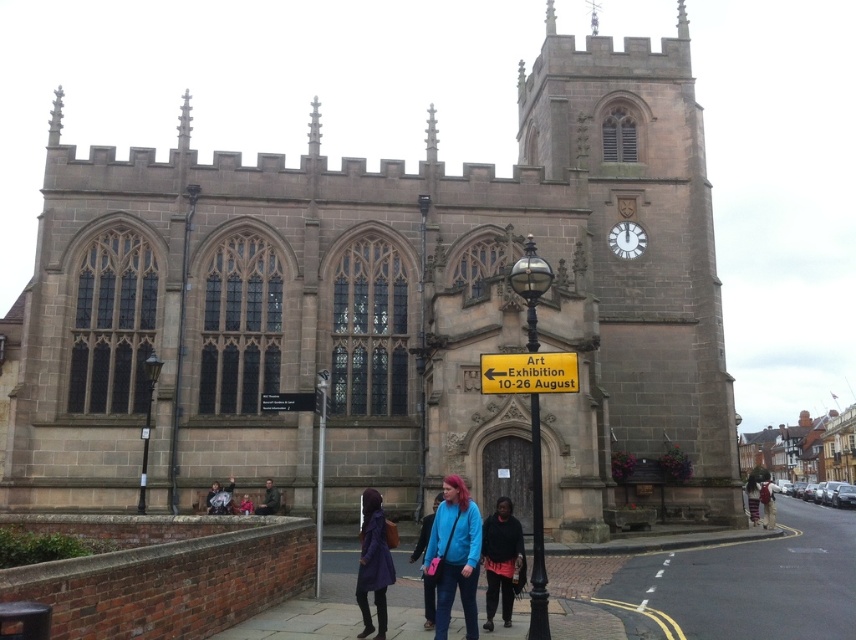
You are standing in front of the historic stone church and want to take a photo. You notice two points marked in the scene. Which point, point (x=715, y=442) or point (x=849, y=515), is closer to you?

Point (x=715, y=442) is closer to the camera than point (x=849, y=515), so it is closer to you.

You are standing in front of the historic stone church and want to walk to the smooth concrete pavement at lower right. Which direction should you move relative to the brown stone clock tower at center?

You should move to the right of the brown stone clock tower at center to reach the smooth concrete pavement at lower right, as the smooth concrete pavement at lower right is located to the right side of the brown stone clock tower at center.